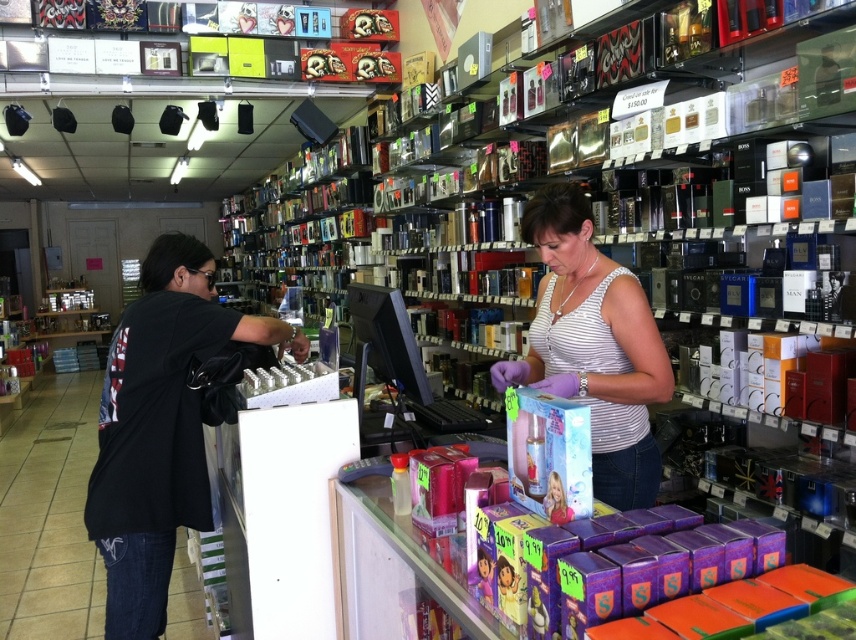
You are standing at the entrance of the store and want to ask the person in the white striped tank top at center for assistance. Which direction should you walk to reach them?

The white striped tank top at center is located at point 0.541 on the x axis and 0.694 on the y axis. Since you are at the entrance, you should walk towards the center of the store to reach them.

You are a delivery person who needs to place a large package on the checkout counter. The package is 1.5 meters long. The counter has a white striped tank top at center and a camera. Can you fit the package on the counter without moving any items?

The distance between the white striped tank top at center and the camera is 1.35 meters, which is shorter than the package length of 1.5 meters. Therefore, the package cannot be placed on the counter without moving items.

You are a customer in the store and want to know if you can comfortably walk between the two people at the checkout counter. The width of your body is 50 centimeters. The two people are wearing the white striped tank top at center and the black fabric shirt at left. Can you fit through the space between them?

The distance between the white striped tank top at center and the black fabric shirt at left is 97.30 centimeters. Since your body width is 50 centimeters, you can comfortably fit through the space between them.